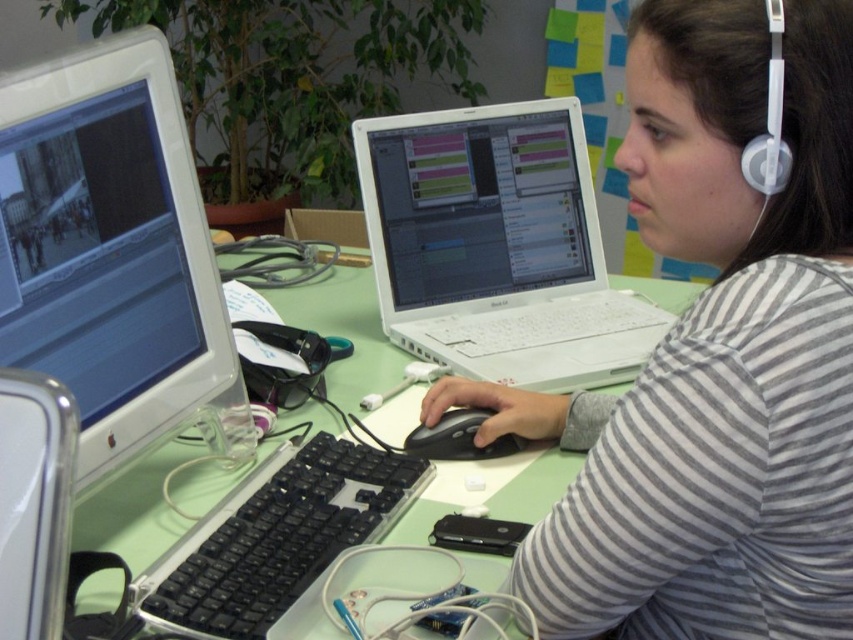
In the scene shown: Who is positioned more to the right, gray striped shirt at center or white glossy monitor at left?

gray striped shirt at center is more to the right.

In the scene shown: Is the position of gray striped shirt at center less distant than that of white glossy monitor at left?

Yes, gray striped shirt at center is closer to the viewer.

Does point (844, 548) lie behind point (135, 253)?

No, it is in front of (135, 253).

Locate an element on the screen. Image resolution: width=853 pixels, height=640 pixels. gray striped shirt at center is located at coordinates (712, 356).

Does white glossy monitor at left have a lesser width compared to black plastic keyboard at center?

Yes.

Is white glossy monitor at left closer to camera compared to black plastic keyboard at center?

Yes, white glossy monitor at left is in front of black plastic keyboard at center.

Which is behind, point (21, 129) or point (289, 541)?

The point (289, 541) is behind.

Image resolution: width=853 pixels, height=640 pixels. Identify the location of white glossy monitor at left. (113, 256).

Does gray striped shirt at center have a lesser width compared to black matte mouse at center?

Incorrect, gray striped shirt at center's width is not less than black matte mouse at center's.

Is gray striped shirt at center smaller than black matte mouse at center?

No.

Locate an element on the screen. gray striped shirt at center is located at coordinates (712, 356).